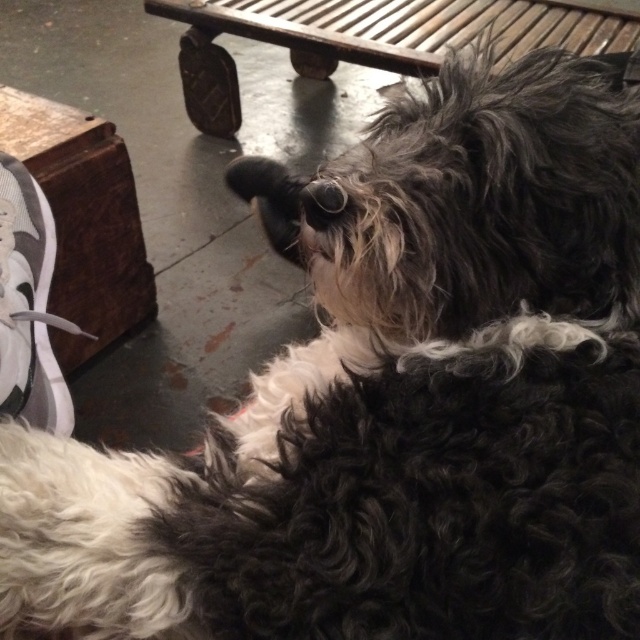
Question: Does wooden bench at upper center have a lesser width compared to wooden park bench at left?

Choices:
 (A) no
 (B) yes

Answer: (A)

Question: Among these objects, which one is nearest to the camera?

Choices:
 (A) wooden park bench at left
 (B) wooden bench at upper center
 (C) white fabric shoe at lower left

Answer: (C)

Question: Which point appears farthest from the camera in this image?

Choices:
 (A) (22, 397)
 (B) (218, 65)
 (C) (106, 243)

Answer: (B)

Question: Is wooden bench at upper center to the right of wooden park bench at left from the viewer's perspective?

Choices:
 (A) no
 (B) yes

Answer: (B)

Question: Does wooden park bench at left have a lesser width compared to white fabric shoe at lower left?

Choices:
 (A) no
 (B) yes

Answer: (A)

Question: Which object is the farthest from the white fabric shoe at lower left?

Choices:
 (A) wooden park bench at left
 (B) wooden bench at upper center

Answer: (B)